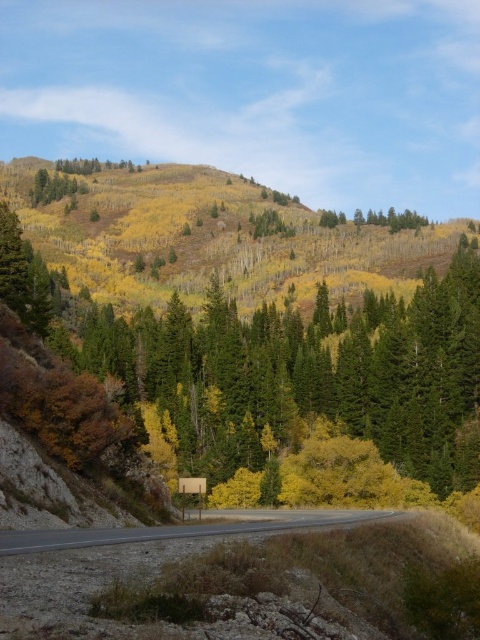
Question: Does gray asphalt road at center appear on the left side of metallic yellow street sign at center?

Choices:
 (A) yes
 (B) no

Answer: (B)

Question: Is gray asphalt road at center bigger than metallic yellow street sign at center?

Choices:
 (A) yes
 (B) no

Answer: (A)

Question: Which point is closer to the camera taking this photo?

Choices:
 (A) (73, 547)
 (B) (197, 502)

Answer: (A)

Question: Can you confirm if gray asphalt road at center is bigger than metallic yellow street sign at center?

Choices:
 (A) yes
 (B) no

Answer: (A)

Question: Which point is farther from the camera taking this photo?

Choices:
 (A) (190, 484)
 (B) (24, 531)

Answer: (A)